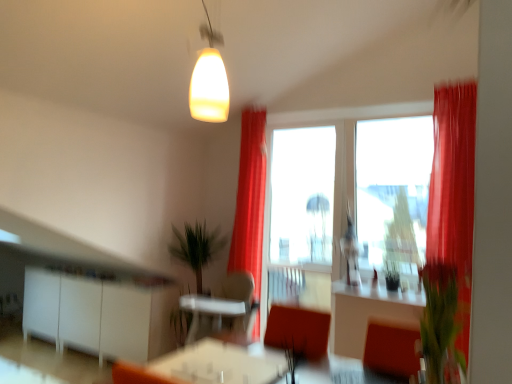
Question: From a real-world perspective, relative to silky red curtain at center, the first curtain viewed from the left, is transparent glass window at center, marked as the first window screen in a left-to-right arrangement, vertically above or below?

Choices:
 (A) above
 (B) below

Answer: (B)

Question: Is point (310, 253) closer or farther from the camera than point (234, 233)?

Choices:
 (A) closer
 (B) farther

Answer: (B)

Question: Estimate the real-world distances between objects in this image. Which object is closer to the silky red curtain at right, the first curtain positioned from the right?

Choices:
 (A) matte orange table at center
 (B) transparent glass window at center, marked as the 2th window screen in a left-to-right arrangement
 (C) green leafy plant at center
 (D) silky red curtain at center, the 2th curtain in the right-to-left sequence
 (E) green leafy plant at right, which is the 2th plant in back-to-front order

Answer: (B)

Question: Which is farther from the transparent glass window at center, which is counted as the second window screen, starting from the back?

Choices:
 (A) matte glass pendant at upper center
 (B) green leafy plant at center
 (C) white glossy counter top at center
 (D) green matte plant at center, the first plant positioned from the bottom
 (E) green leafy plant at right, which is the 2th plant in back-to-front order

Answer: (E)